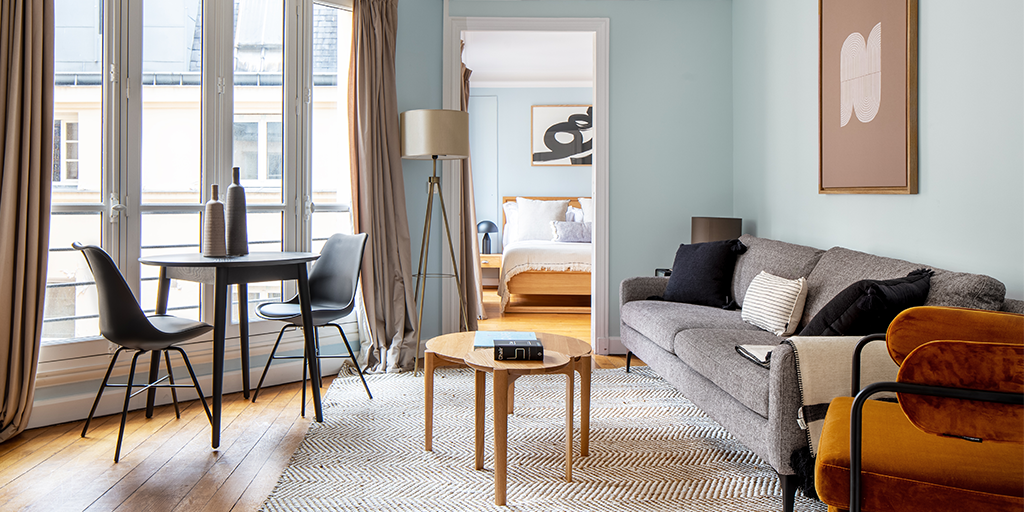
Where is `bed`? Image resolution: width=1024 pixels, height=512 pixels. bed is located at coordinates (540, 257).